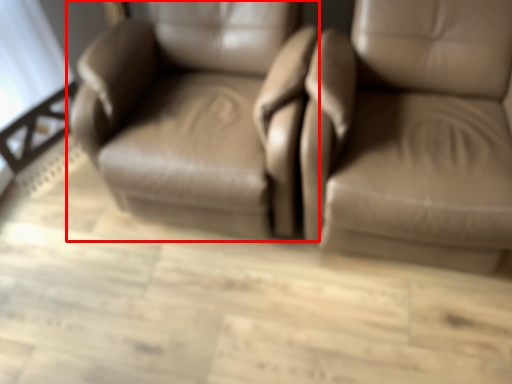
Question: Observing the image, what is the correct spatial positioning of chair (annotated by the red box) in reference to chair?

Choices:
 (A) right
 (B) left

Answer: (B)